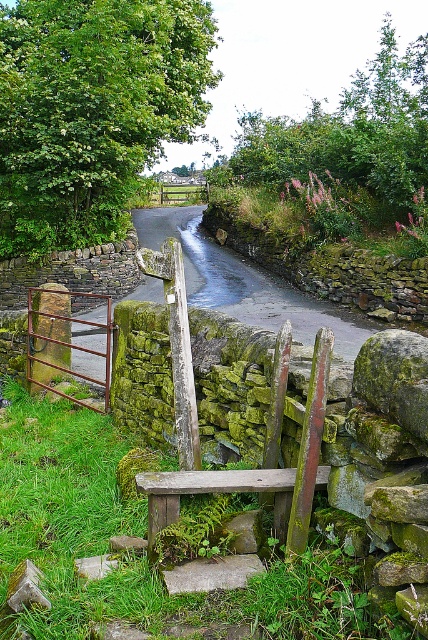
You are a hiker trying to find a specific point marked on your map. The coordinates are given as point (x=142, y=534). Based on the scene, where is this point located?

The point (x=142, y=534) corresponds to the green mossy stone at lower left.

In the scene shown: You are a hiker trying to navigate through this rural area. You see a green leafy tree at upper center and a rusty metal gate at left. Which object would block your view more if you were standing directly in front of them?

The green leafy tree at upper center is taller than the rusty metal gate at left, so it would block your view more.

You are a hiker trying to determine the best path forward. You see a green leafy tree at upper center and a rusty metal gate at left. Which object is wider?

The green leafy tree at upper center is wider than the rusty metal gate at left.